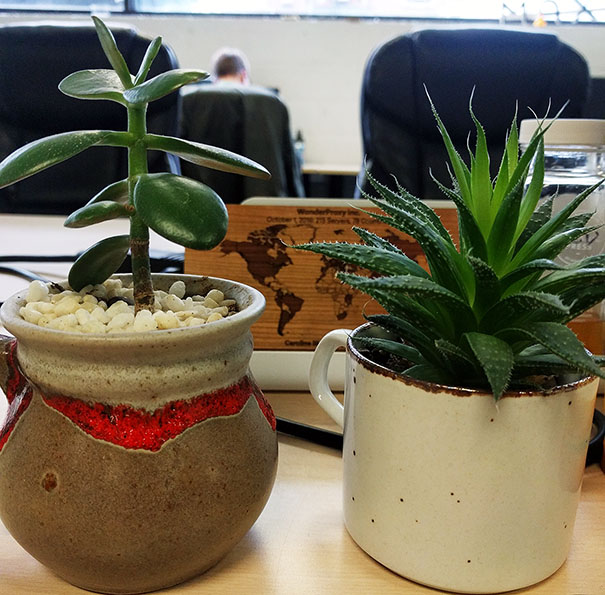
The image size is (605, 595). What are the coordinates of `mug` in the screenshot? It's located at (454, 458).